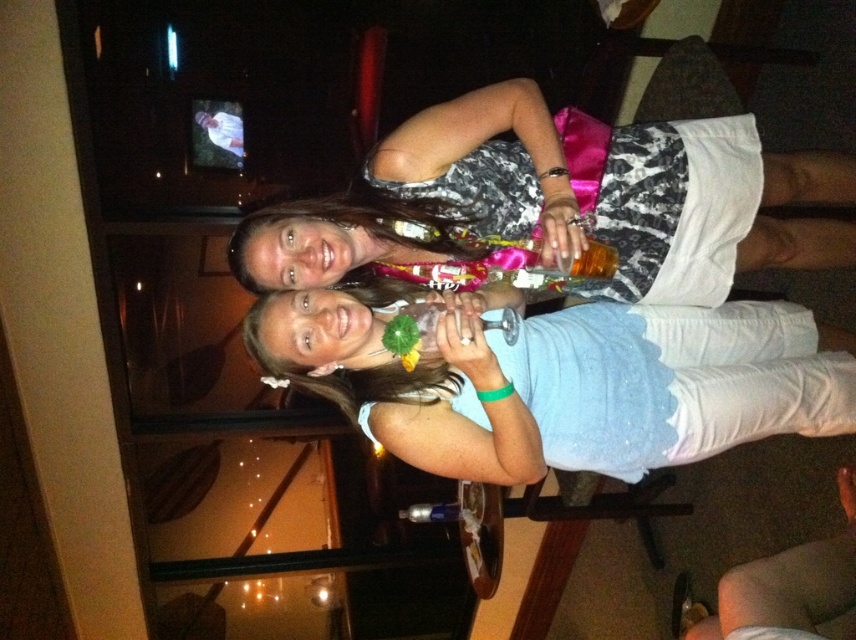
Question: Which point is farther from the camera taking this photo?

Choices:
 (A) (640, 314)
 (B) (532, 122)

Answer: (A)

Question: Which of the following is the closest to the observer?

Choices:
 (A) white matte dress at center
 (B) matte black dress at center

Answer: (A)

Question: Is white matte dress at center smaller than matte black dress at center?

Choices:
 (A) yes
 (B) no

Answer: (A)

Question: Is white matte dress at center bigger than matte black dress at center?

Choices:
 (A) no
 (B) yes

Answer: (A)

Question: From the image, what is the correct spatial relationship of white matte dress at center in relation to matte black dress at center?

Choices:
 (A) below
 (B) above

Answer: (A)

Question: Which of the following is the closest to the observer?

Choices:
 (A) white matte dress at center
 (B) matte black dress at center

Answer: (A)